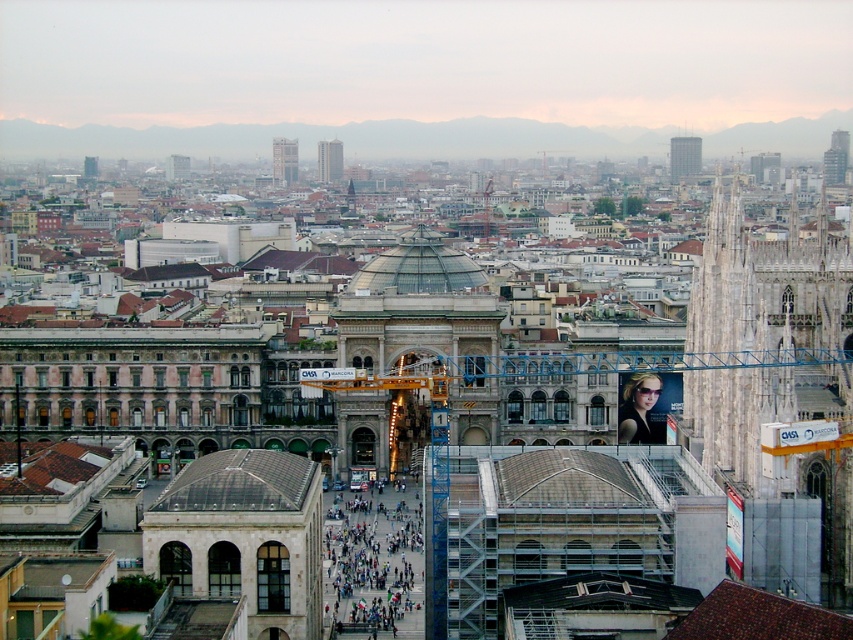
Question: Does dark gray concrete plaza at center have a greater width compared to gray concrete skyscraper at upper right?

Choices:
 (A) no
 (B) yes

Answer: (B)

Question: Is gray concrete skyscraper at upper right to the left of smooth glass skyscraper at center from the viewer's perspective?

Choices:
 (A) no
 (B) yes

Answer: (A)

Question: Which point is closer to the camera?

Choices:
 (A) matte glass skyscraper at center
 (B) shiny black sunglasses at center
 (C) gray concrete skyscraper at upper right

Answer: (B)

Question: Does stone dome at center have a smaller size compared to dark gray concrete plaza at center?

Choices:
 (A) no
 (B) yes

Answer: (A)

Question: Among these objects, which one is nearest to the camera?

Choices:
 (A) gray concrete skyscraper at upper right
 (B) matte glass skyscraper at center
 (C) smooth glass skyscraper at center

Answer: (B)

Question: Which point is farther to the camera?

Choices:
 (A) shiny black sunglasses at center
 (B) dark gray concrete plaza at center
 (C) gray concrete skyscraper at upper right

Answer: (C)